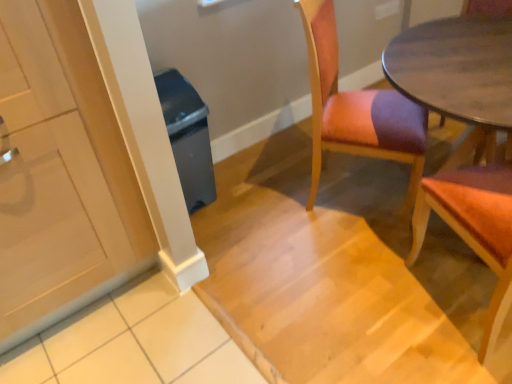
I want to click on free spot to the right of gray plastic trash can at left, so click(237, 188).